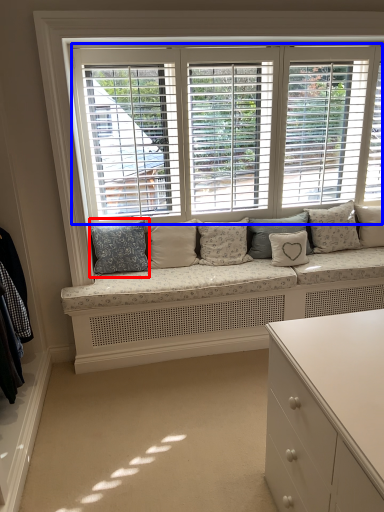
Question: Which object is closer to the camera taking this photo, pillow (highlighted by a red box) or window (highlighted by a blue box)?

Choices:
 (A) pillow
 (B) window

Answer: (B)